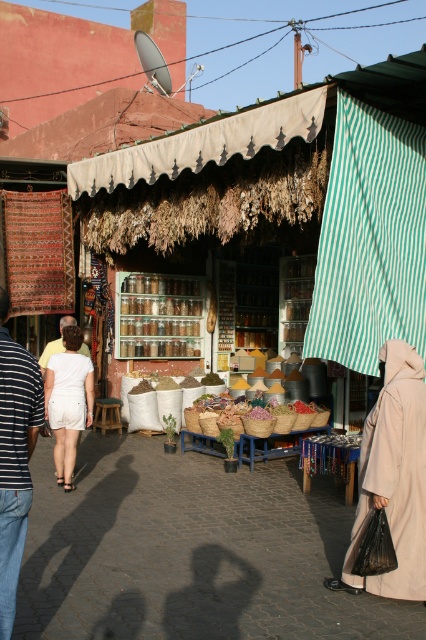
You are a customer at the market and want to pick up both the white cotton shorts at center and the light brown leather jacket at center. If your arms can reach 1.6 meters, can you grab both items at the same time without moving your position?

The distance between the white cotton shorts at center and the light brown leather jacket at center is 1.63 meters. Since your arms can only reach 1.6 meters, you cannot grab both items at the same time without moving your position.

You are a customer at the market and want to buy both the white cotton shorts at center and the light brown leather jacket at center. The vendor has a small bag that can only hold one item. Which item should you choose to fit in the bag?

The light brown leather jacket at center is smaller in size than the white cotton shorts at center, so you should choose the light brown leather jacket at center to fit in the bag.